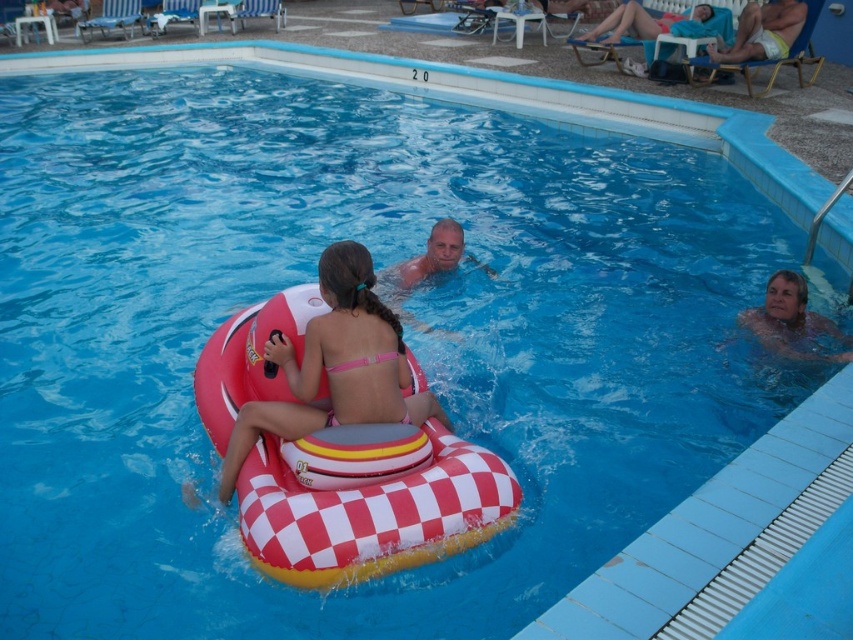
You are a photographer at the poolside and want to capture a photo of the matte pink bikini at center and the blue fabric towel at upper right. Which object should you focus on first if you want to ensure both are in sharp focus?

The matte pink bikini at center is in front of the blue fabric towel at upper right, so you should focus on the matte pink bikini at center first to ensure both are in sharp focus.

You are designing a safety map for the pool area. The pool has a no diving zone marked from coordinates 0.4 to 0.6 on the x and y axes. Is the matte pink bikini at center within this no diving zone?

The matte pink bikini at center is located at point (335, 365), which falls within the no diving zone marked from 0.4 to 0.6 on both axes. Therefore, it is within the restricted area.